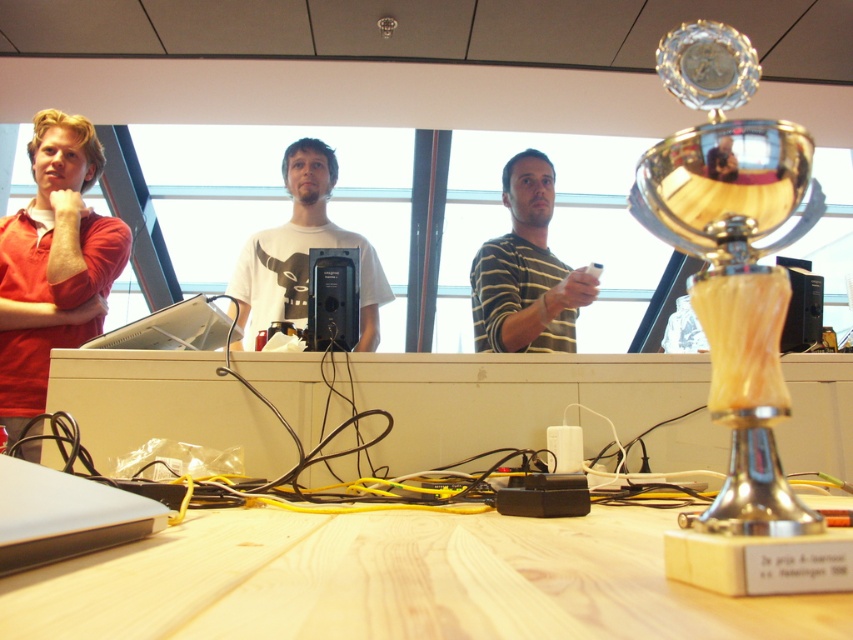
Who is higher up, striped cotton shirt at center or silver metallic laptop at lower left?

striped cotton shirt at center

Which of these two, striped cotton shirt at center or silver metallic laptop at lower left, stands shorter?

silver metallic laptop at lower left is shorter.

I want to click on striped cotton shirt at center, so click(526, 269).

Who is taller, striped cotton shirt at center or white matte t-shirt at center?

white matte t-shirt at center is taller.

Find the location of a particular element. The height and width of the screenshot is (640, 853). striped cotton shirt at center is located at coordinates (526, 269).

This screenshot has width=853, height=640. What do you see at coordinates (53, 262) in the screenshot? I see `matte red shirt at left` at bounding box center [53, 262].

Does point (102, 307) come behind point (517, 266)?

Yes, point (102, 307) is behind point (517, 266).

Where is `matte red shirt at left`? The height and width of the screenshot is (640, 853). matte red shirt at left is located at coordinates (53, 262).

Identify the location of matte red shirt at left. Image resolution: width=853 pixels, height=640 pixels. (53, 262).